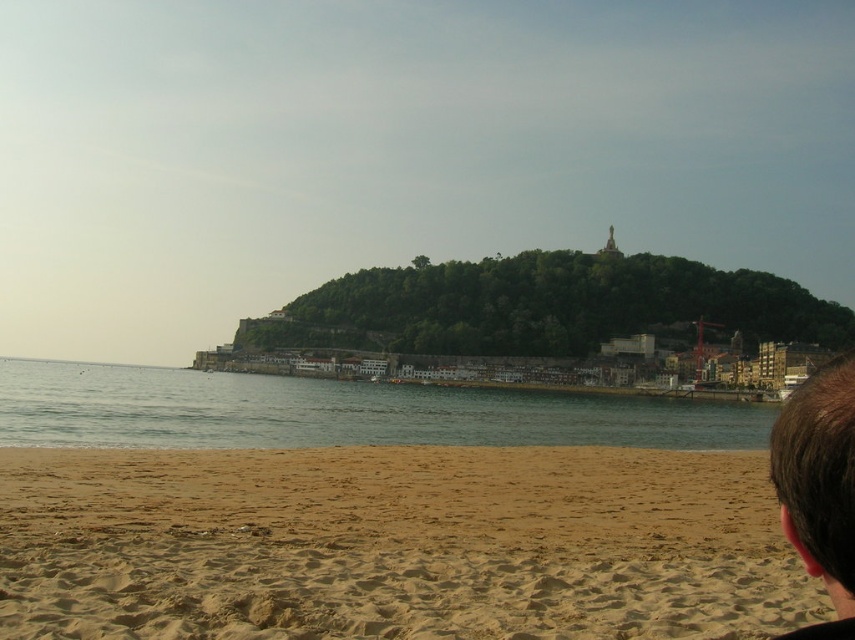
Question: Does clear water at lower center have a lesser width compared to brown hair at lower right?

Choices:
 (A) yes
 (B) no

Answer: (B)

Question: Does fine-grained sand at lower left have a smaller size compared to brown hair at lower right?

Choices:
 (A) no
 (B) yes

Answer: (B)

Question: Is clear water at lower center thinner than brown hair at lower right?

Choices:
 (A) yes
 (B) no

Answer: (B)

Question: Which object is closer to the camera taking this photo?

Choices:
 (A) clear water at lower center
 (B) fine-grained sand at lower left

Answer: (B)

Question: Which point is closer to the camera taking this photo?

Choices:
 (A) (850, 481)
 (B) (650, 515)

Answer: (A)

Question: Among these objects, which one is nearest to the camera?

Choices:
 (A) brown hair at lower right
 (B) fine-grained sand at lower left

Answer: (A)